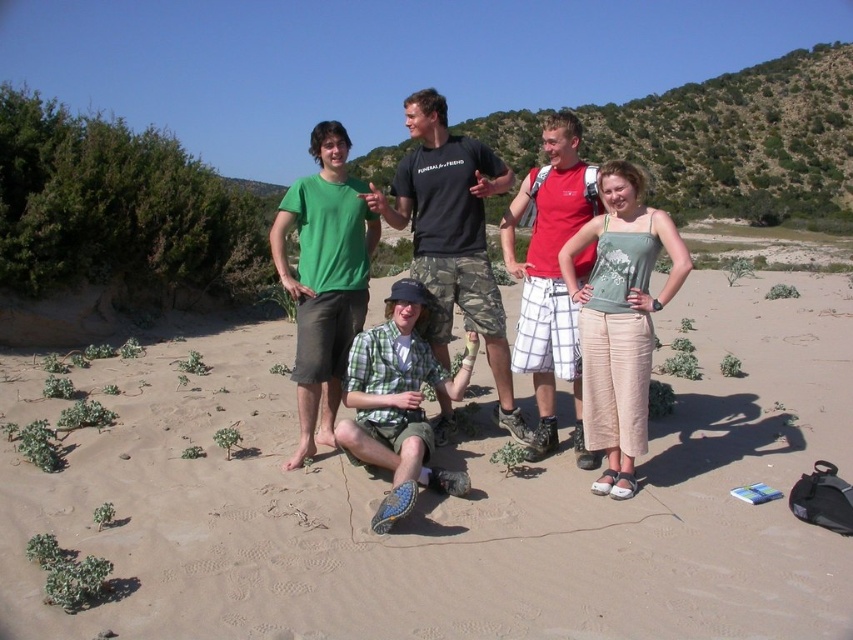
You are standing at point (584,550) and want to walk to point (641,428). Which direction should you move in relation to the seated person with the camera?

You should move behind the seated person with the camera because point (584,550) is in front of point (641,428), so moving from the front to the back relative to the seated person would lead you to the desired point.

You are a photographer trying to capture a group photo of the beige sandy beach at center and the light green fabric tank top at center. Which object should be placed to the left side to align with the existing scene?

The beige sandy beach at center should be placed to the left side of the light green fabric tank top at center because it is already positioned on the left side of it in the scene.